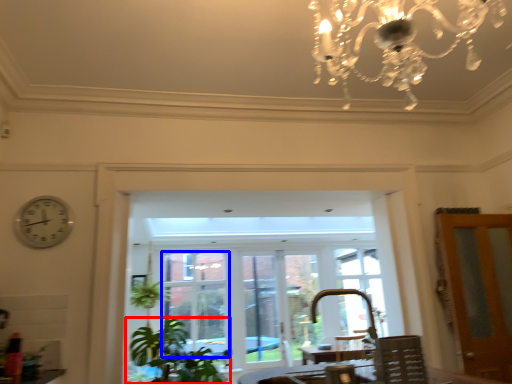
Question: Which object appears farthest to the camera in this image, houseplant (highlighted by a red box) or window (highlighted by a blue box)?

Choices:
 (A) houseplant
 (B) window

Answer: (B)